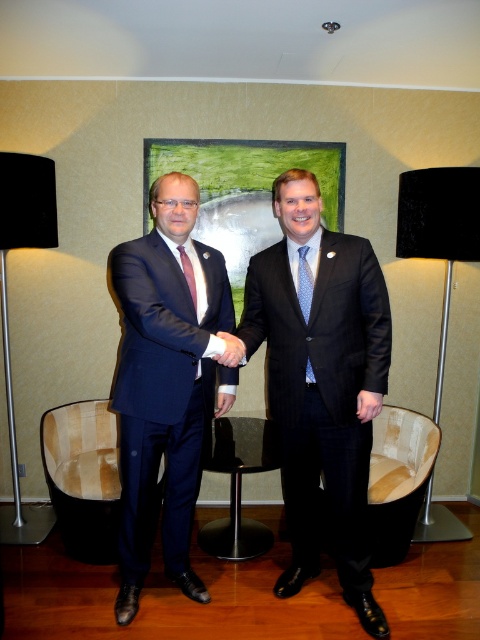
Does point (26, 224) come in front of point (186, 257)?

That is False.

Can you confirm if black fabric lamp at left is positioned above matte red tie at center?

No.

Who is more forward, [19,529] or [192,268]?

Positioned in front is point [192,268].

Identify the location of black fabric lamp at left. The image size is (480, 640). click(x=7, y=307).

Can you confirm if shiny black suit at center is positioned to the right of matte red tie at center?

Correct, you'll find shiny black suit at center to the right of matte red tie at center.

Between point (308, 243) and point (191, 292), which one is positioned in front?

Point (191, 292) is more forward.

What are the coordinates of `shiny black suit at center` in the screenshot? It's located at (322, 385).

You are a GUI agent. You are given a task and a screenshot of the screen. Output one action in this format:
    pyautogui.click(x=<x>, y=<y>)
    Task: Click on the shiny black suit at center
    The width and height of the screenshot is (480, 640).
    Given the screenshot: What is the action you would take?
    pyautogui.click(x=322, y=385)

Does point (333, 372) come closer to viewer compared to point (415, 221)?

Yes.

Which is above, shiny black suit at center or black fabric lamp at right?

black fabric lamp at right is higher up.

Which is in front, point (308, 340) or point (463, 212)?

Point (308, 340) is in front.

Image resolution: width=480 pixels, height=640 pixels. In order to click on shiny black suit at center in this screenshot , I will do `click(322, 385)`.